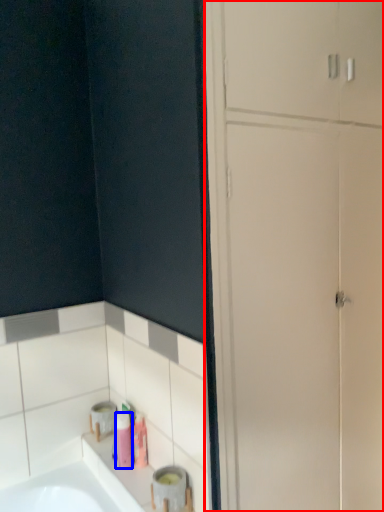
Question: Which object is further to the camera taking this photo, dresser (highlighted by a red box) or toiletry (highlighted by a blue box)?

Choices:
 (A) dresser
 (B) toiletry

Answer: (B)